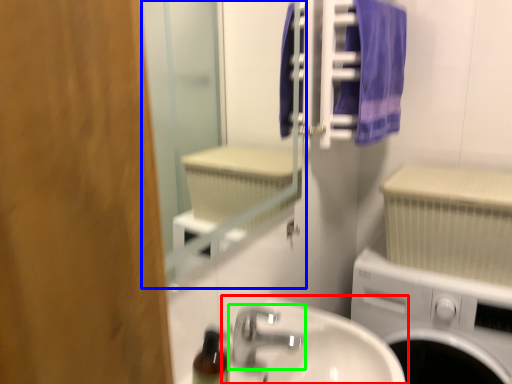
Question: Considering the real-world distances, which object is closest to sink (highlighted by a red box)? mirror (highlighted by a blue box) or tap (highlighted by a green box).

Choices:
 (A) mirror
 (B) tap

Answer: (B)